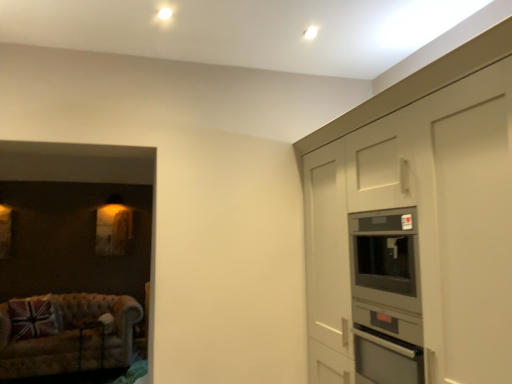
Question: Is metallic silver table at lower left at the left side of union jack fabric pillow at lower left?

Choices:
 (A) no
 (B) yes

Answer: (A)

Question: Considering the relative sizes of metallic silver table at lower left and union jack fabric pillow at lower left in the image provided, is metallic silver table at lower left thinner than union jack fabric pillow at lower left?

Choices:
 (A) no
 (B) yes

Answer: (B)

Question: Is metallic silver table at lower left smaller than union jack fabric pillow at lower left?

Choices:
 (A) yes
 (B) no

Answer: (A)

Question: Would you say metallic silver table at lower left is a long distance from union jack fabric pillow at lower left?

Choices:
 (A) no
 (B) yes

Answer: (A)

Question: From a real-world perspective, is metallic silver table at lower left located beneath union jack fabric pillow at lower left?

Choices:
 (A) no
 (B) yes

Answer: (B)

Question: Is the position of metallic silver table at lower left less distant than that of union jack fabric pillow at lower left?

Choices:
 (A) no
 (B) yes

Answer: (B)

Question: From a real-world perspective, is union jack fabric pillow at lower left located higher than velvet beige couch at lower left?

Choices:
 (A) yes
 (B) no

Answer: (A)

Question: Is union jack fabric pillow at lower left outside velvet beige couch at lower left?

Choices:
 (A) no
 (B) yes

Answer: (A)

Question: From the image's perspective, does union jack fabric pillow at lower left appear lower than velvet beige couch at lower left?

Choices:
 (A) no
 (B) yes

Answer: (A)

Question: Does union jack fabric pillow at lower left come in front of velvet beige couch at lower left?

Choices:
 (A) no
 (B) yes

Answer: (A)

Question: Considering the relative positions of union jack fabric pillow at lower left and velvet beige couch at lower left in the image provided, is union jack fabric pillow at lower left to the right of velvet beige couch at lower left from the viewer's perspective?

Choices:
 (A) no
 (B) yes

Answer: (A)

Question: Is union jack fabric pillow at lower left further to the viewer compared to velvet beige couch at lower left?

Choices:
 (A) yes
 (B) no

Answer: (A)

Question: Would you say union jack fabric pillow at lower left contains matte gray cabinetry at right?

Choices:
 (A) no
 (B) yes

Answer: (A)